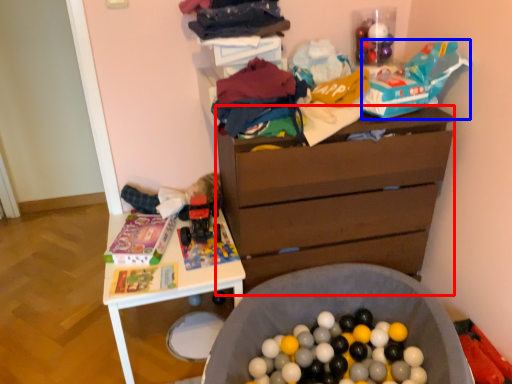
Question: Which object is closer to the camera taking this photo, chest of drawers (highlighted by a red box) or toy (highlighted by a blue box)?

Choices:
 (A) chest of drawers
 (B) toy

Answer: (B)